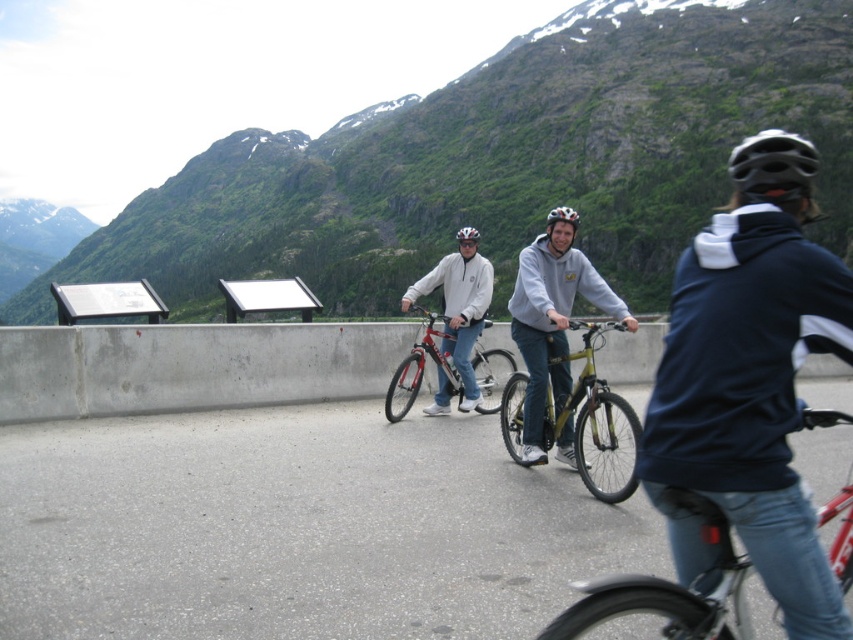
Does matte gray hoodie at center appear under black matte helmet at center?

Correct, matte gray hoodie at center is located below black matte helmet at center.

Is point (550, 300) in front of point (558, 211)?

No, (550, 300) is behind (558, 211).

Where is `matte gray hoodie at center`? matte gray hoodie at center is located at coordinates (550, 323).

Is shiny silver bicycle at center positioned before shiny black helmet at upper right?

Yes, shiny silver bicycle at center is closer to the viewer.

The width and height of the screenshot is (853, 640). What do you see at coordinates (668, 588) in the screenshot? I see `shiny silver bicycle at center` at bounding box center [668, 588].

Between point (616, 616) and point (795, 152), which one is positioned in front?

Point (616, 616) is in front.

The image size is (853, 640). Find the location of `shiny silver bicycle at center`. shiny silver bicycle at center is located at coordinates (668, 588).

Can you confirm if green grassy mountain at upper center is bigger than matte black helmet at center?

Yes.

I want to click on green grassy mountain at upper center, so pyautogui.click(x=498, y=163).

Who is more distant from viewer, (241, 252) or (567, 216)?

Point (241, 252)

Locate an element on the screen. green grassy mountain at upper center is located at coordinates (498, 163).